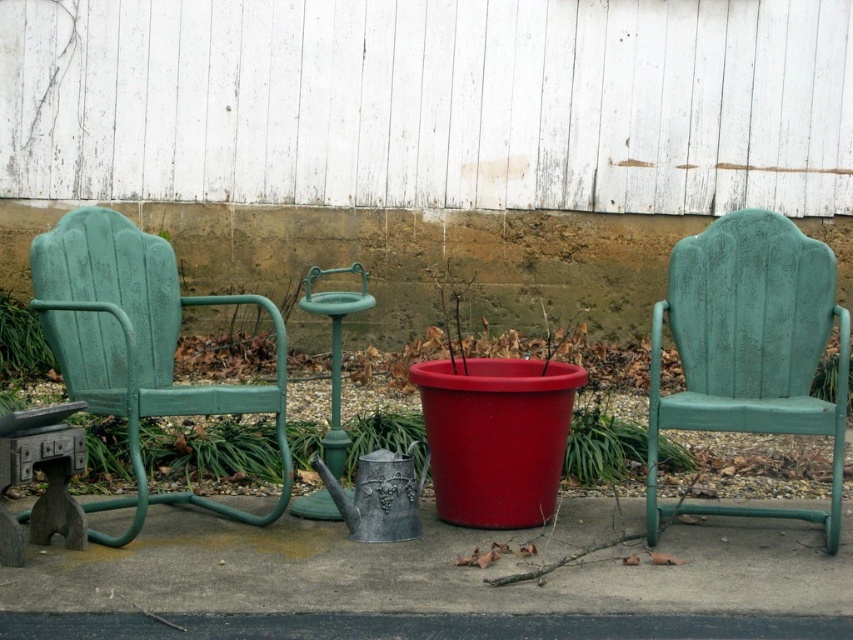
Question: Is green distressed wood chair at right bigger than green painted metal chair at left?

Choices:
 (A) yes
 (B) no

Answer: (B)

Question: Which point is closer to the camera taking this photo?

Choices:
 (A) (154, 259)
 (B) (688, 298)

Answer: (B)

Question: Among these points, which one is nearest to the camera?

Choices:
 (A) (735, 412)
 (B) (259, 518)

Answer: (A)

Question: Does green distressed wood chair at right appear under green painted metal chair at left?

Choices:
 (A) no
 (B) yes

Answer: (B)

Question: Does green distressed wood chair at right have a larger size compared to green painted metal chair at left?

Choices:
 (A) yes
 (B) no

Answer: (B)